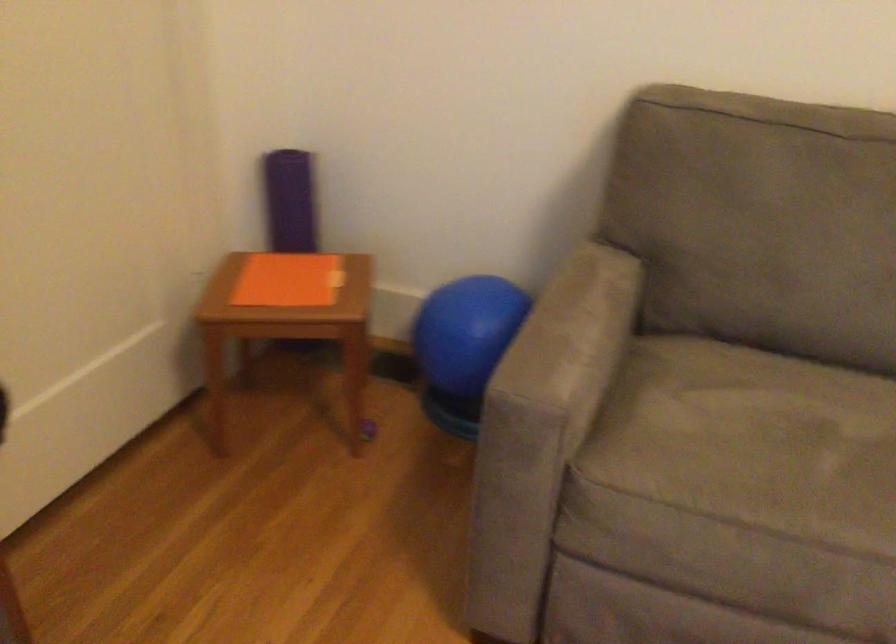
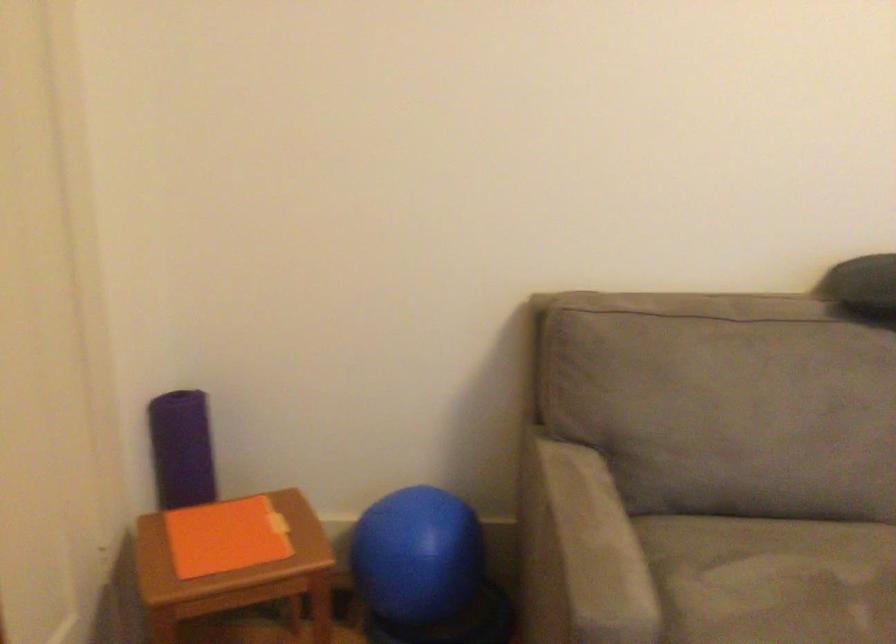
Question: The images are taken continuously from a first-person perspective. In which direction are you moving?

Choices:
 (A) Left
 (B) Right
 (C) Forward
 (D) Backward

Answer: (A)